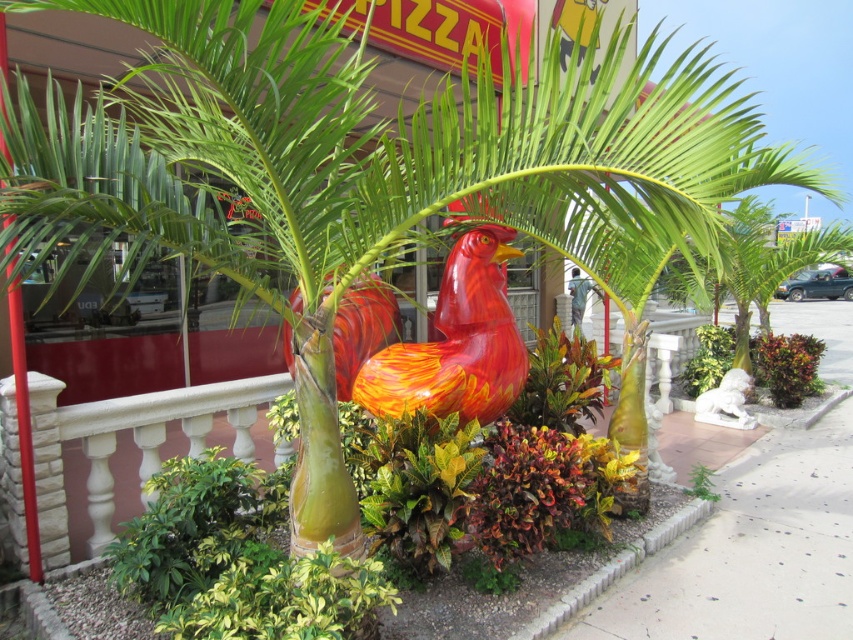
You are standing at the center of the sidewalk in front of the pizza restaurant. The shiny red and orange rooster at center is your main focus. If you walk straight ahead, will you collide with the rooster?

The rooster is positioned at point (456, 342), which is at the center of the scene. Since you are also standing at the center of the sidewalk, walking straight ahead would lead you directly toward the rooster, so there is a risk of collision.

You are a delivery person trying to place a brick at lower right next to the shiny orange bird at center. Considering their sizes, will the brick fit comfortably next to the bird without overcrowding the space?

The shiny orange bird at center is bigger than brick at lower right, so the brick at lower right will fit comfortably next to the bird without overcrowding the space since it is smaller in size.

You are a delivery person trying to park your motorcycle between the shiny red and orange rooster at center and the shiny orange bird at center. Can you fit your motorcycle there if it requires 1.2 meters of space?

The shiny red and orange rooster at center occupies less space than the shiny orange bird at center. However, the description does not specify the exact distance between them, so it is unclear if there is enough space for the motorcycle requiring 1.2 meters.